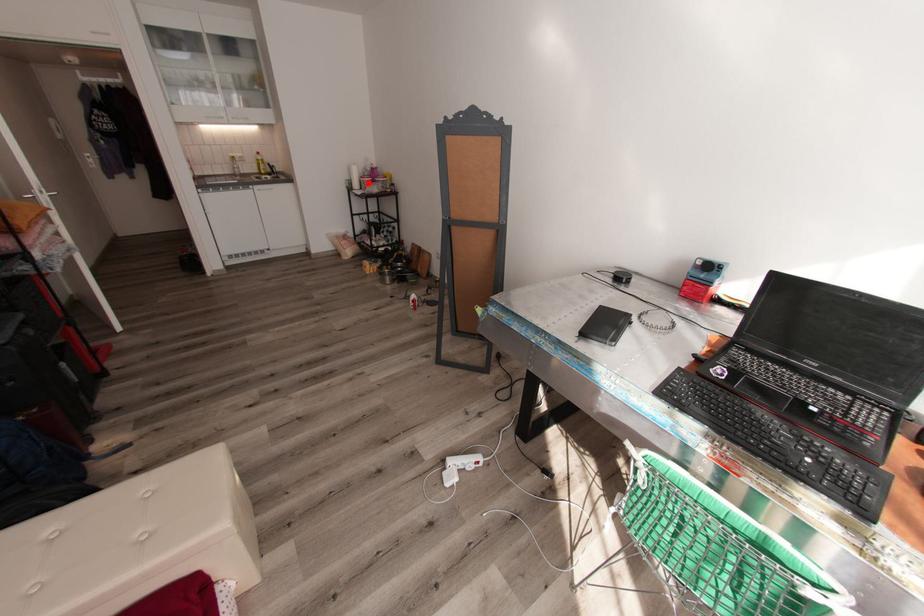
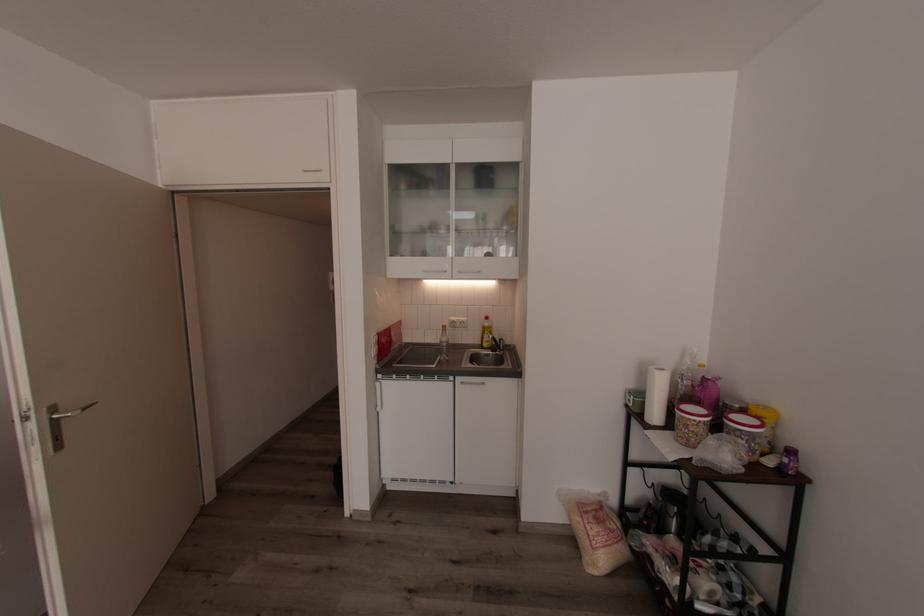
In the second image, find the point that corresponds to the highlighted location in the first image.

(690, 426)